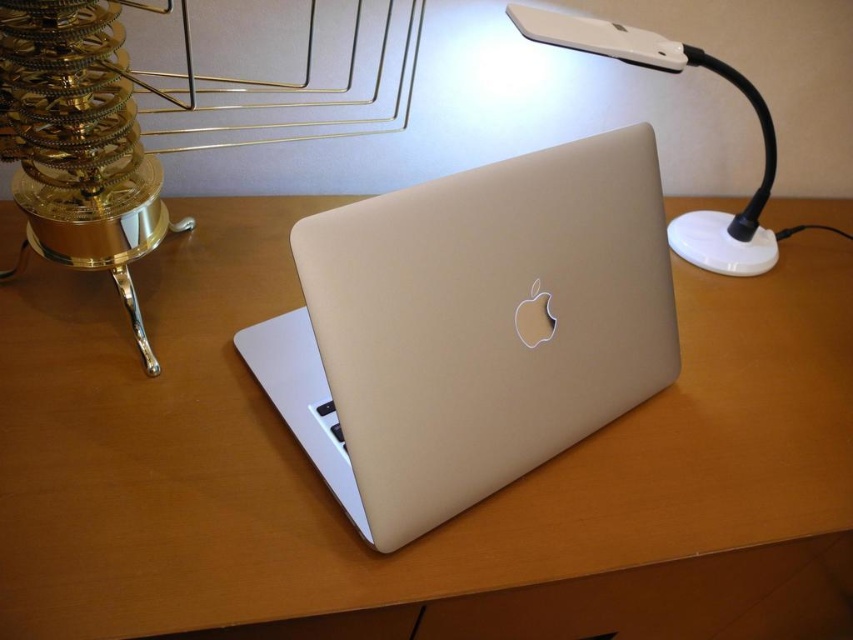
Can you confirm if wooden table at center is shorter than white plastic lamp at upper right?

No.

What do you see at coordinates (321, 484) in the screenshot? Image resolution: width=853 pixels, height=640 pixels. I see `wooden table at center` at bounding box center [321, 484].

Locate an element on the screen. The image size is (853, 640). wooden table at center is located at coordinates (321, 484).

Does wooden table at center appear under satin gold laptop at center?

Yes.

Does wooden table at center have a larger size compared to satin gold laptop at center?

Correct, wooden table at center is larger in size than satin gold laptop at center.

Which is behind, point (239, 282) or point (340, 461)?

The point (239, 282) is behind.

Image resolution: width=853 pixels, height=640 pixels. Find the location of `wooden table at center`. wooden table at center is located at coordinates (321, 484).

Is satin gold laptop at center positioned at the back of white plastic lamp at upper right?

Answer: That is False.

Does point (463, 506) come farther from viewer compared to point (751, 205)?

That is False.

Where is `satin gold laptop at center`? The width and height of the screenshot is (853, 640). satin gold laptop at center is located at coordinates (471, 326).